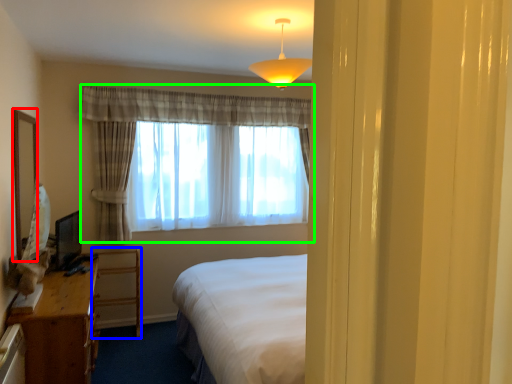
Question: Which is nearer to the mirror (highlighted by a red box)? furniture (highlighted by a blue box) or curtain (highlighted by a green box).

Choices:
 (A) furniture
 (B) curtain

Answer: (A)